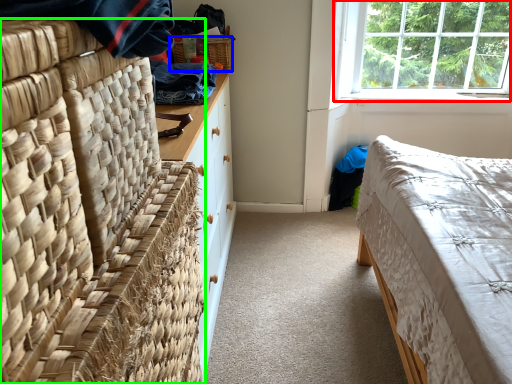
Question: Which object is positioned farthest from window (highlighted by a red box)? Select from picnic basket (highlighted by a blue box) and furniture (highlighted by a green box).

Choices:
 (A) picnic basket
 (B) furniture

Answer: (B)